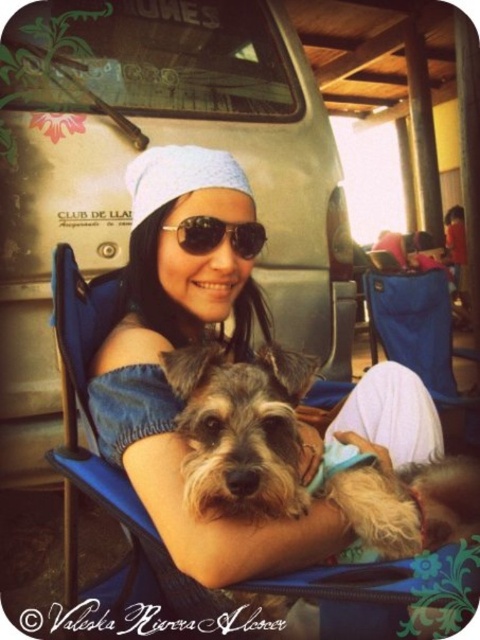
You are standing at the point labeled as point (x=253, y=422) in the image. You want to take a photo of the woman and her dog from your current position. Considering the distance between you and the point, will you be able to capture the entire scene comfortably in your camera frame?

The distance between you and the point (x=253, y=422) is 28.39 inches. Since this distance is relatively close, capturing the entire scene of the woman and her dog might be challenging as you may need to step back further to fit them all into the frame.

You are a photographer trying to capture a candid shot of the woman and her dog. You notice the blue fabric folding chair at lower right is obstructing the view. Can you move the fuzzy brown dog at center to get a clear shot of the chair?

The fuzzy brown dog at center is positioned over blue fabric folding chair at lower right, so moving the dog would reveal the chair.

You are a photographer trying to capture the perfect shot of the fuzzy brown dog at center. According to the coordinates given, where should you position your camera to ensure the dog is centered in the frame?

The fuzzy brown dog at center is already positioned at coordinates point (240, 428), so to center it in the frame, the camera should be aligned to focus precisely on that point.